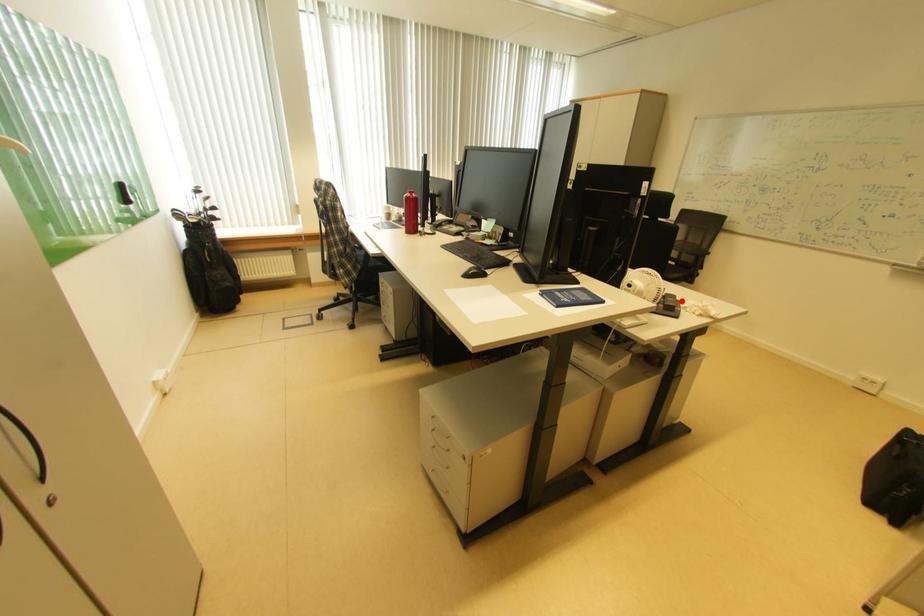
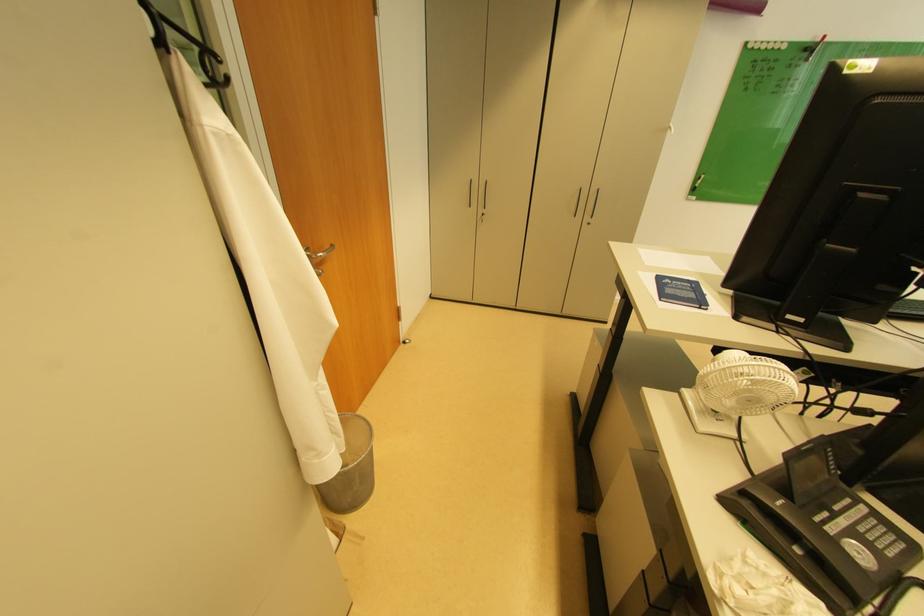
Where in the second image is the point corresponding to the highlighted location from the first image?

(786, 506)